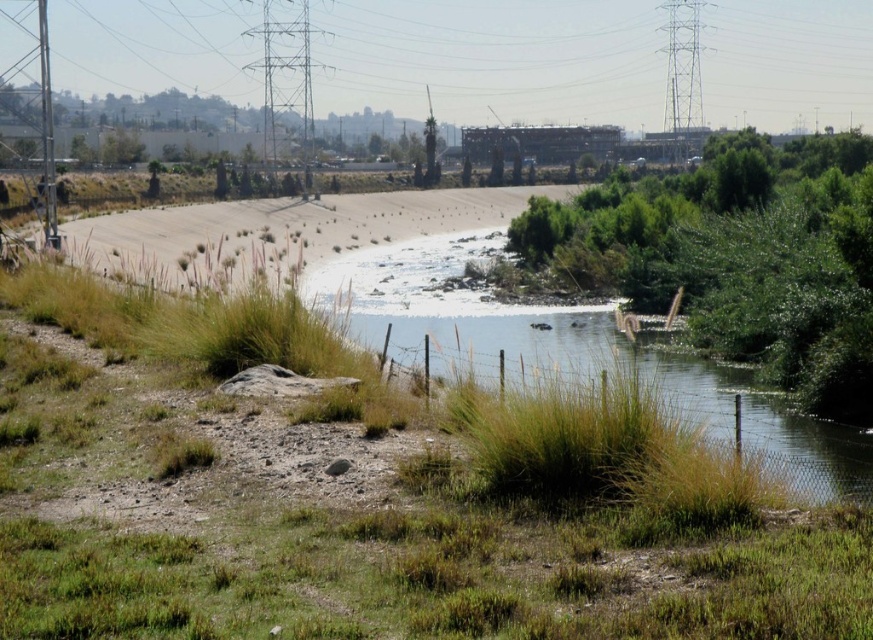
Question: Which point is closer to the camera?

Choices:
 (A) green grassy river at center
 (B) green grass at center

Answer: (B)

Question: Among these objects, which one is nearest to the camera?

Choices:
 (A) green grassy river at center
 (B) green grass at center

Answer: (B)

Question: Is green grass at center to the right of green grassy river at center from the viewer's perspective?

Choices:
 (A) yes
 (B) no

Answer: (A)

Question: Does green grass at center appear on the left side of green grassy river at center?

Choices:
 (A) no
 (B) yes

Answer: (A)

Question: Is green grass at center to the left of green grassy river at center from the viewer's perspective?

Choices:
 (A) yes
 (B) no

Answer: (B)